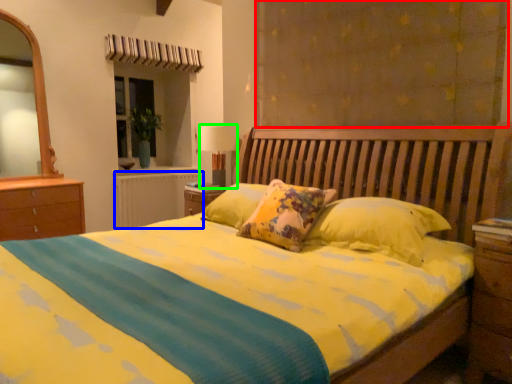
Question: Based on their relative distances, which object is farther from curtain (highlighted by a red box)? Choose from radiator (highlighted by a blue box) and table lamp (highlighted by a green box).

Choices:
 (A) radiator
 (B) table lamp

Answer: (A)